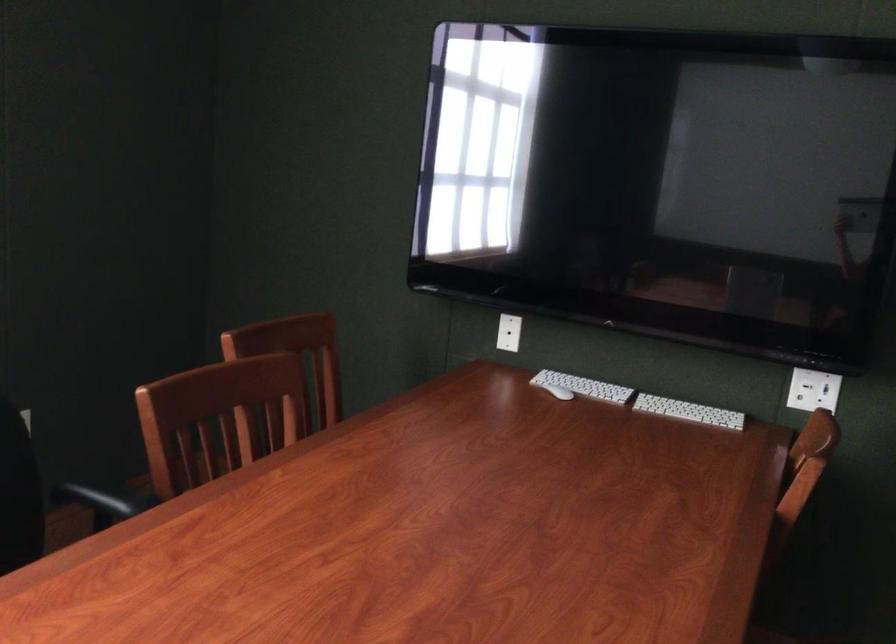
Image resolution: width=896 pixels, height=644 pixels. What do you see at coordinates (99, 496) in the screenshot?
I see `the chair armrest` at bounding box center [99, 496].